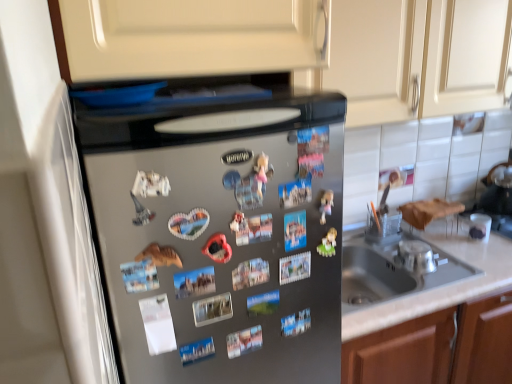
Locate an element on the screen. This screenshot has width=512, height=384. vacant area that is in front of silver metallic bowl at sink is located at coordinates (442, 287).